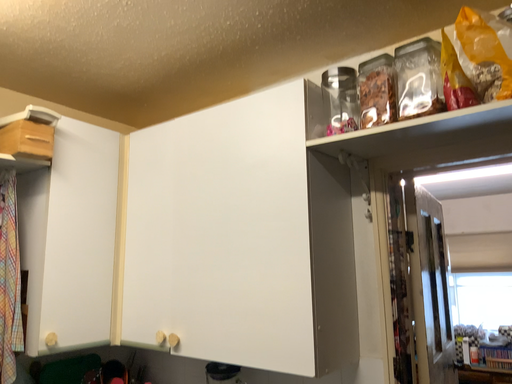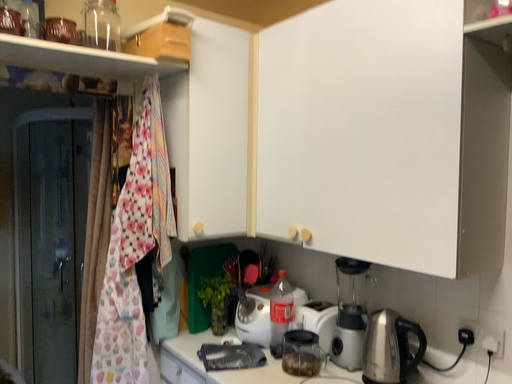
Question: How did the camera likely rotate when shooting the video?

Choices:
 (A) rotated downward
 (B) rotated upward

Answer: (A)